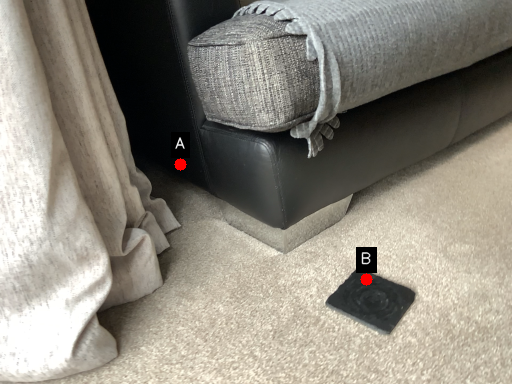
Question: Two points are circled on the image, labeled by A and B beside each circle. Which of the following is the closest to the observer?

Choices:
 (A) A is closer
 (B) B is closer

Answer: (B)